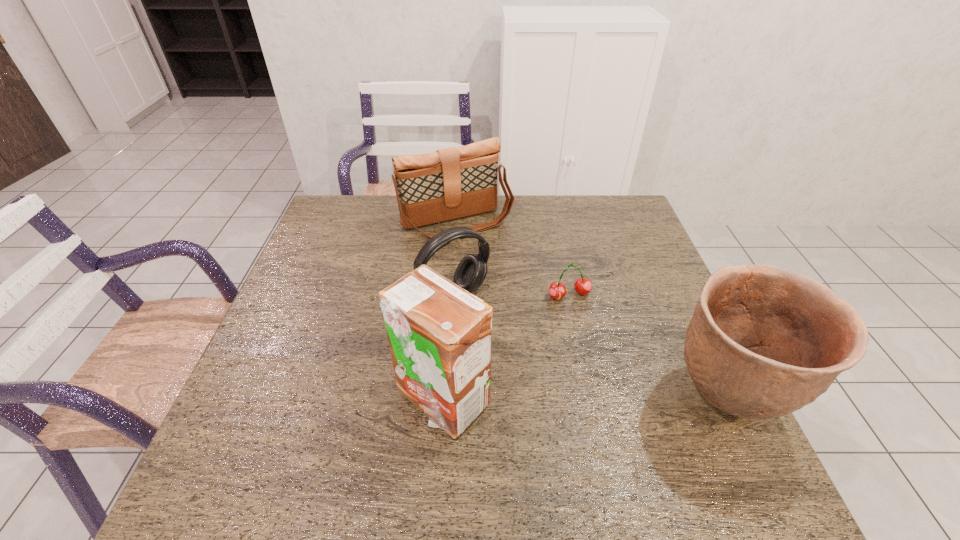
What are the coordinates of `free space on the desktop that is between the carton and the rightmost object and is positioned on the front-facing side of the farthest object` in the screenshot? It's located at (564, 399).

This screenshot has height=540, width=960. Identify the location of free spot on the desktop that is between the carton and the rightmost object and is positioned with stems pointing upwards on the cherry. (623, 399).

Where is `free spot on the desktop that is between the carton and the rightmost object and is positioned on the earcups of the fourth tallest object`? This screenshot has height=540, width=960. free spot on the desktop that is between the carton and the rightmost object and is positioned on the earcups of the fourth tallest object is located at coordinates (542, 399).